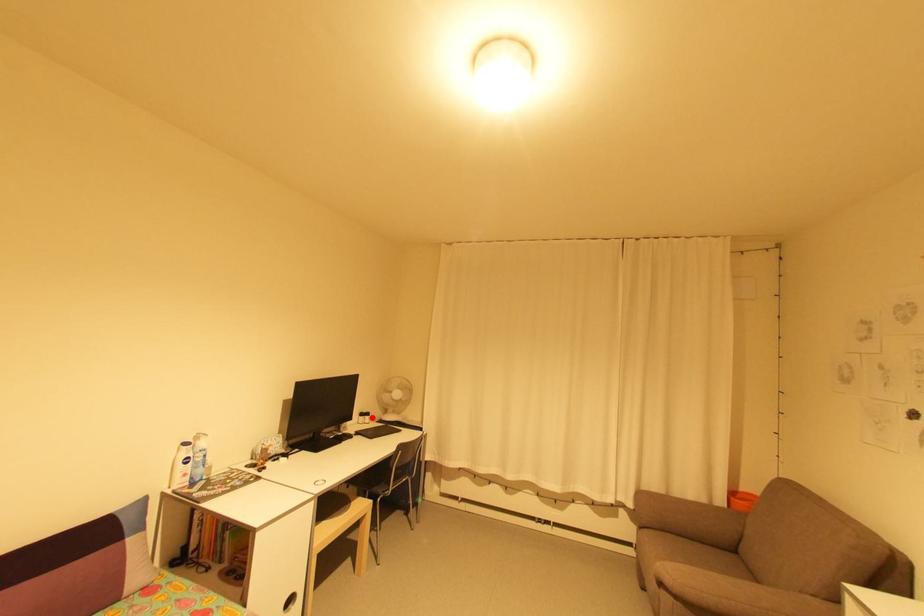
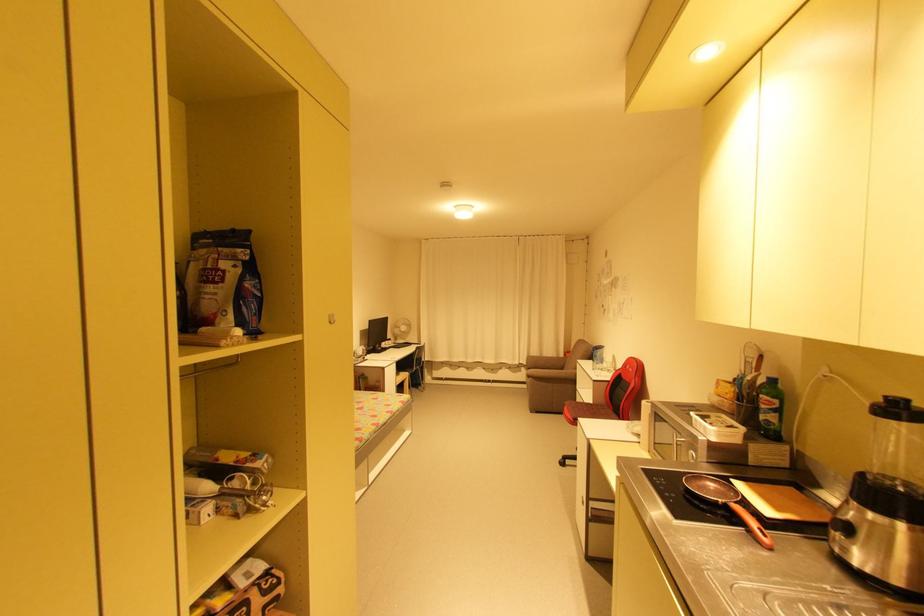
In the second image, find the point that corresponds to the highlighted location in the first image.

(395, 342)